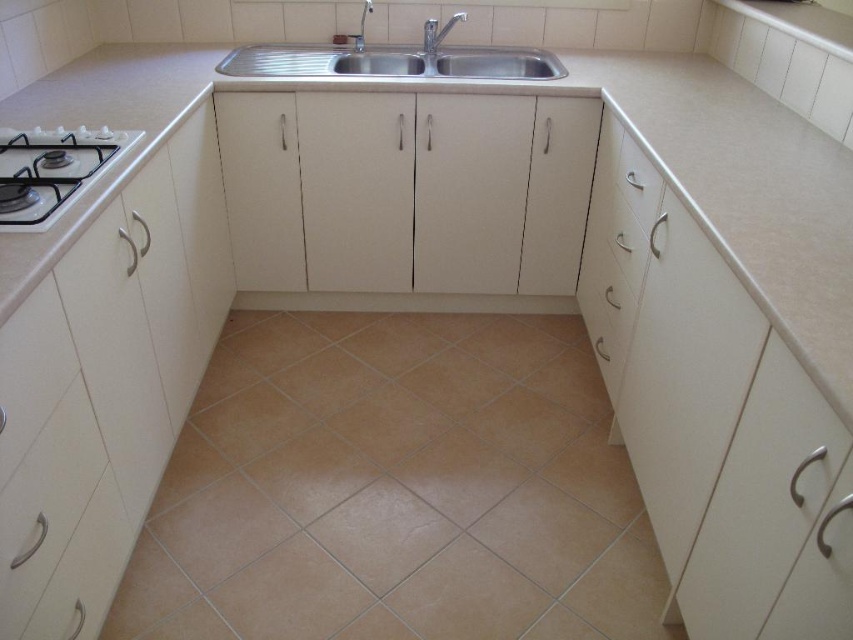
You are standing in the kitchen and want to wash your hands. The sink is in the center of the image. Which direction should you move relative to the white glossy gas stove at left to reach the sink?

The white glossy gas stove at left is located at point (51, 170). Since the sink is in the center of the image, you should move towards the right from the white glossy gas stove at left to reach the sink.

You are a kitchen designer planning to install a new appliance between the stainless steel sink at center and the silver metallic faucet at upper center. Which side of the sink should the appliance be placed to ensure it is closer to the faucet?

The appliance should be placed to the right side of the stainless steel sink at center since the silver metallic faucet at upper center is located to the right of the sink.

You are a plumber inspecting the kitchen layout. You need to determine if the silver metallic faucet at upper center can properly supply water to the stainless steel sink at center. Based on their positions, is this possible?

The stainless steel sink at center is positioned under the silver metallic faucet at upper center, so yes, the faucet can supply water to the sink as it is located above the sink.